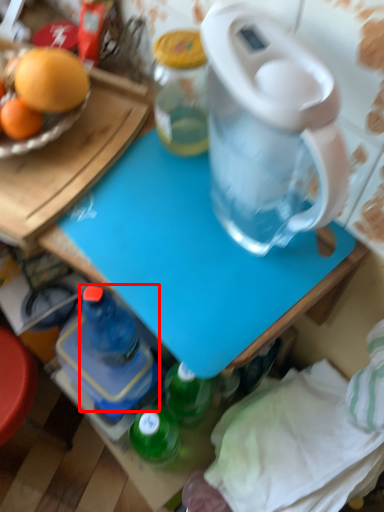
Question: Observing the image, what is the correct spatial positioning of bottle (annotated by the red box) in reference to table?

Choices:
 (A) left
 (B) right

Answer: (A)